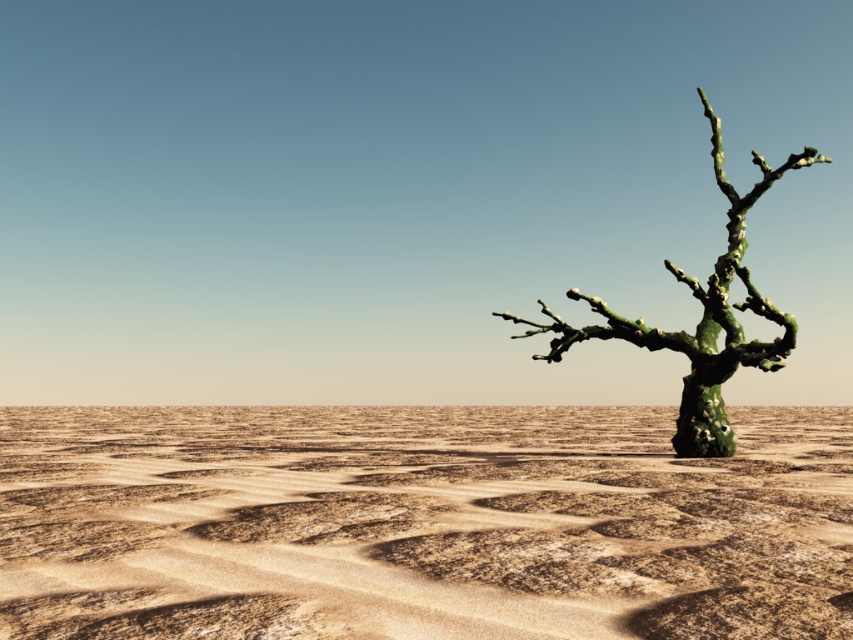
Question: Is the position of brown textured sand at center less distant than that of green mossy tree at right?

Choices:
 (A) yes
 (B) no

Answer: (A)

Question: Which object appears farthest from the camera in this image?

Choices:
 (A) green mossy tree at right
 (B) brown textured sand at center

Answer: (A)

Question: Which object appears closest to the camera in this image?

Choices:
 (A) brown textured sand at center
 (B) green mossy tree at right

Answer: (A)

Question: Is brown textured sand at center smaller than green mossy tree at right?

Choices:
 (A) yes
 (B) no

Answer: (B)

Question: Considering the relative positions of brown textured sand at center and green mossy tree at right in the image provided, where is brown textured sand at center located with respect to green mossy tree at right?

Choices:
 (A) above
 (B) below

Answer: (B)